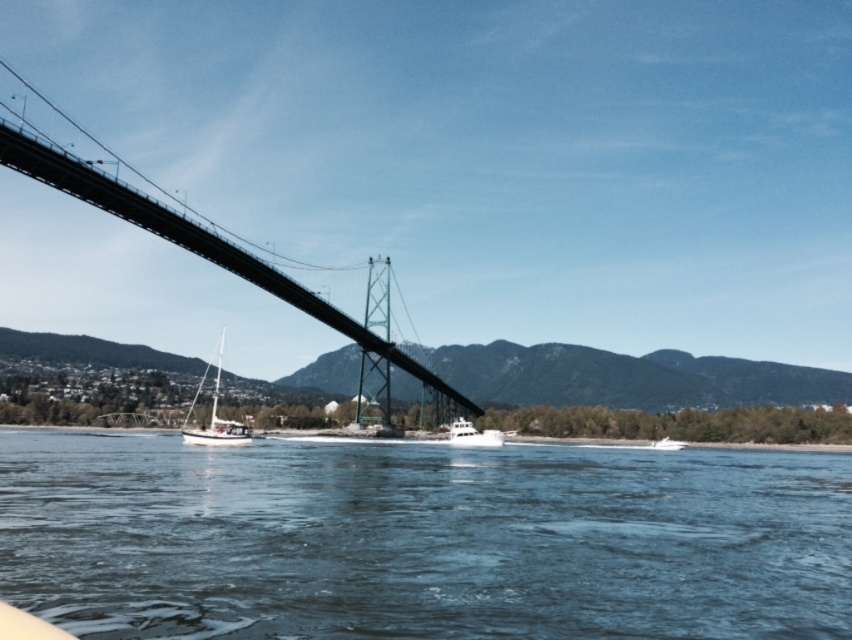
You are standing at the point with coordinates point (473, 436) and want to walk to the point with coordinates point (507, 451). According to the scene, will you be moving forward or backward relative to the bridge?

Since point (507, 451) is behind point (473, 436), moving from point (473, 436) to point (507, 451) would mean moving backward relative to the bridge.

You are standing on the bridge and looking down at the water. There is a white matte sailboat at lower left and a motorboat with a white hull. Which boat is closer to the point at coordinates (x=214, y=417)?

The white matte sailboat at lower left is located at point (x=214, y=417), so it is exactly at that coordinate point.